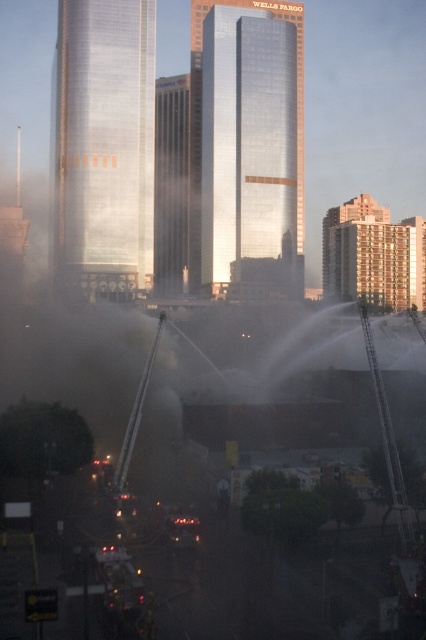
You are a drone operator tasked with delivering a package to the shiny metallic skyscraper at center. Given the current firefighting operations with water jets spraying from fire trucks, can you safely navigate your drone through the area without encountering the water streams?

The shiny metallic skyscraper at center is located at point (x=103, y=147). Since the water jets are spraying upwards and outwards from the fire trucks in the foreground, the drone should be able to navigate around the water streams by adjusting its flight path to avoid the misty area created by the spraying. However, the exact feasibility depends on the drone operator carefully plotting a route that avoids the active water jets.

You are a drone operator tasked with capturing aerial footage of the reflective glass skyscraper at center and the glossy glass skyscraper at center during the fire emergency. The drone has a maximum flight range of 20 meters. Can you fly the drone from one skyscraper to the other without exceeding its range?

The reflective glass skyscraper at center and glossy glass skyscraper at center are 17.31 meters apart. Since the drone has a maximum flight range of 20 meters, it can safely fly between them without exceeding its range.

Based on the scene description, which skyscraper is shorter? The shiny metallic skyscraper at center or the glossy glass skyscraper at center?

The shiny metallic skyscraper at center is shorter than the glossy glass skyscraper at center.